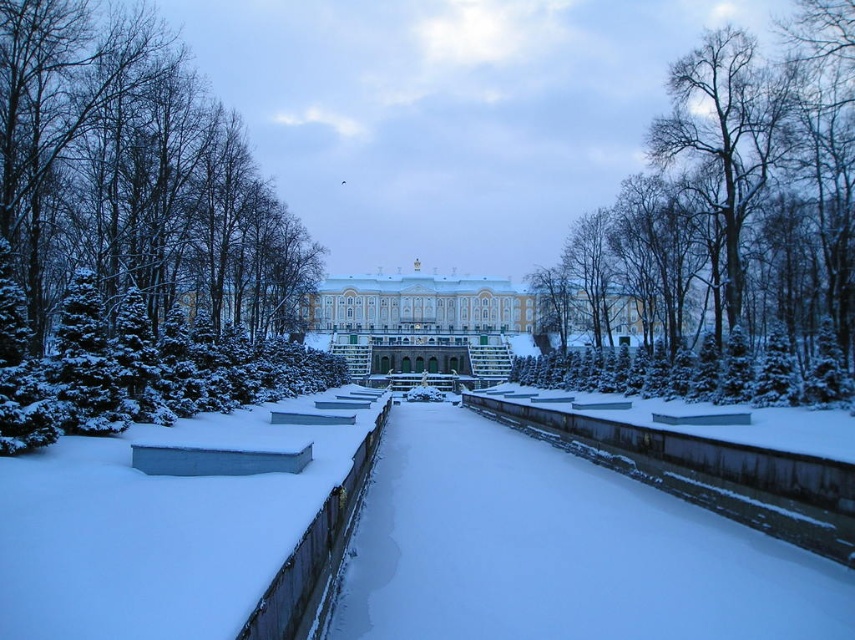
The width and height of the screenshot is (855, 640). What do you see at coordinates (134, 236) in the screenshot?
I see `snow-covered evergreen tree at center` at bounding box center [134, 236].

Is point (4, 77) farther from camera compared to point (823, 292)?

No.

Is point (215, 392) closer to viewer compared to point (841, 83)?

That is True.

At what (x,y) coordinates should I click in order to perform the action: click on snow-covered evergreen tree at center. Please return your answer as a coordinate pair (x, y). This screenshot has height=640, width=855. Looking at the image, I should click on (134, 236).

Which of these two, bare wood tree at upper right or white stone palace at center, stands taller?

bare wood tree at upper right is taller.

Which of these two, bare wood tree at upper right or white stone palace at center, stands shorter?

With less height is white stone palace at center.

Describe the element at coordinates (734, 218) in the screenshot. I see `bare wood tree at upper right` at that location.

Identify the location of bare wood tree at upper right. Image resolution: width=855 pixels, height=640 pixels. (734, 218).

Is snow-covered evergreen tree at center taller than white stone palace at center?

Yes, snow-covered evergreen tree at center is taller than white stone palace at center.

Who is lower down, snow-covered evergreen tree at center or white stone palace at center?

white stone palace at center

Find the location of a particular element. This screenshot has width=855, height=640. snow-covered evergreen tree at center is located at coordinates (134, 236).